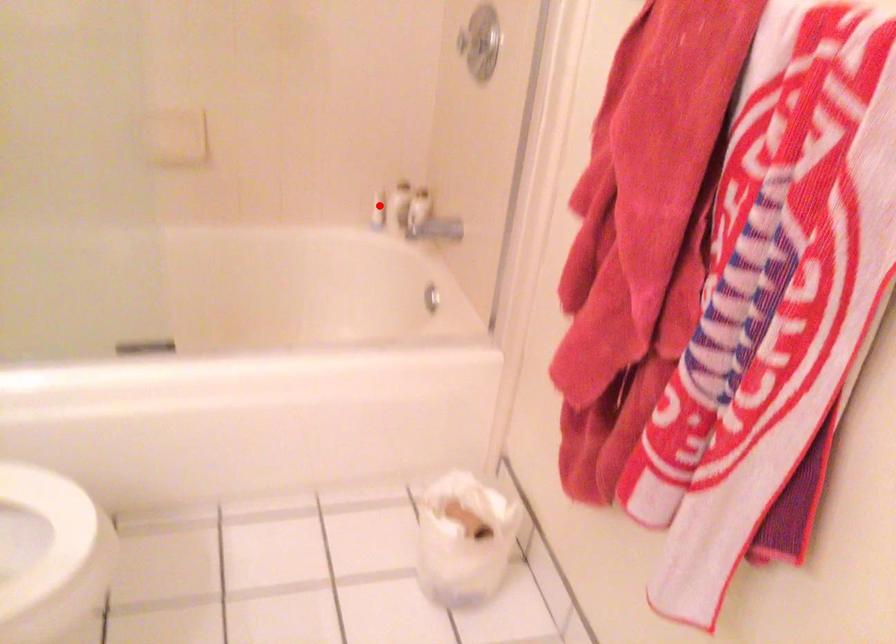
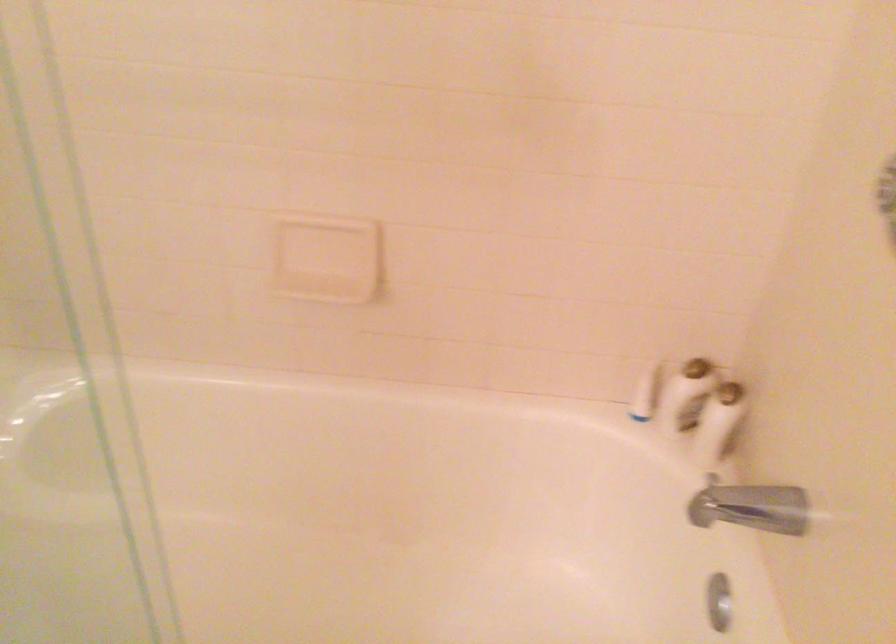
Question: A red point is marked in image1. In image2, is the corresponding 3D point closer to the camera or farther? Reply with the corresponding letter.

Choices:
 (A) The corresponding 3D point is closer.
 (B) The corresponding 3D point is farther.

Answer: (A)